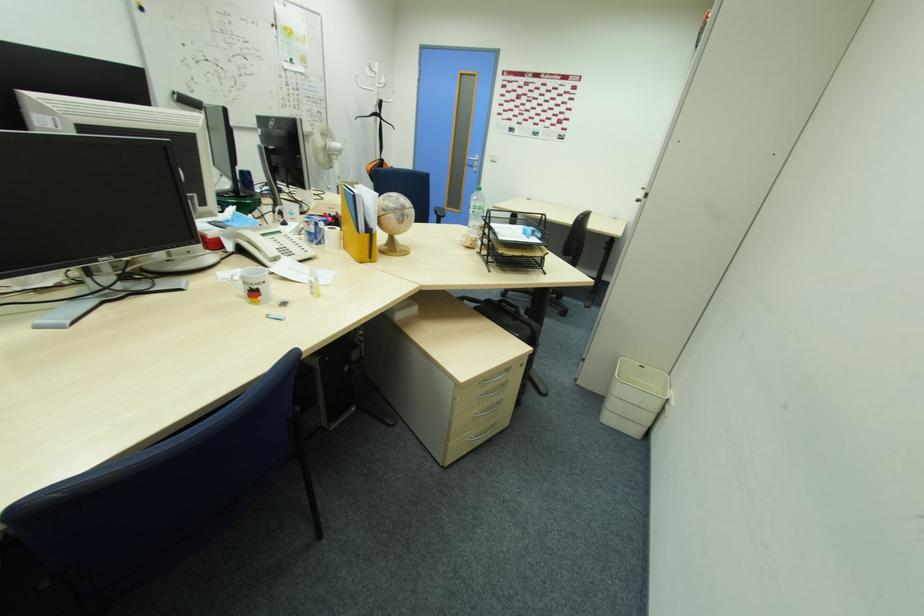
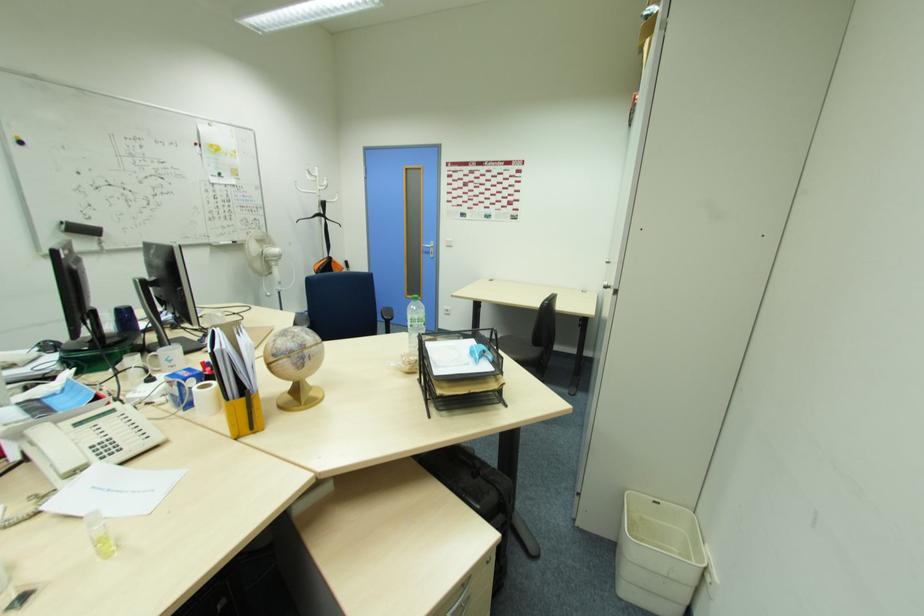
Where in the second image is the point corresponding to pixel 602 418 from the first image?

(618, 590)